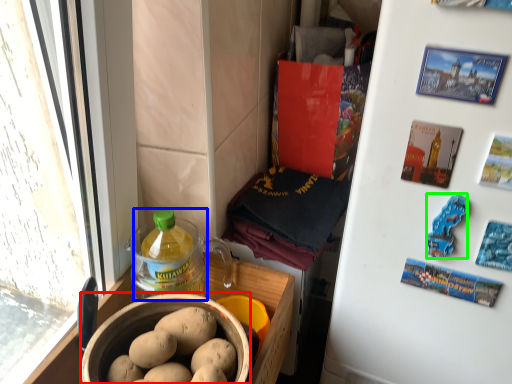
Question: Based on their relative distances, which object is nearer to bowl (highlighted by a red box)? Choose from bottle (highlighted by a blue box) and food (highlighted by a green box).

Choices:
 (A) bottle
 (B) food

Answer: (A)